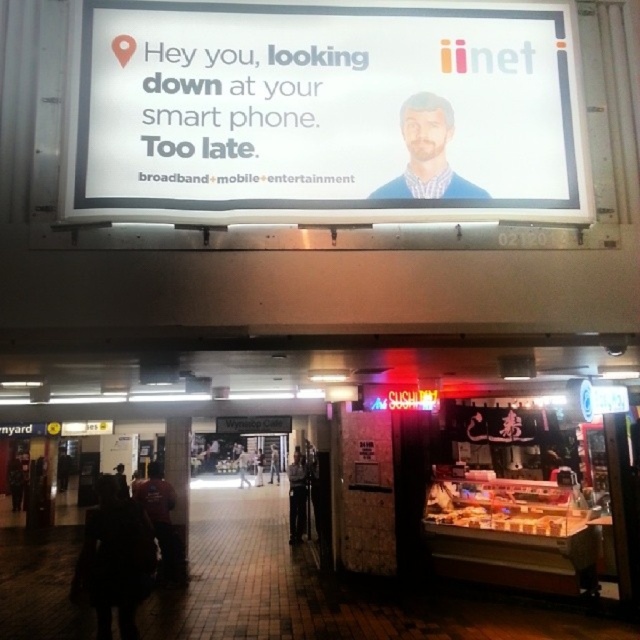
Question: Can you confirm if dark clothing at lower left is positioned below smooth skin person at center?

Choices:
 (A) no
 (B) yes

Answer: (A)

Question: Which object is farther from the camera taking this photo?

Choices:
 (A) dark clothing at lower left
 (B) matte blue shirt at center
 (C) smooth skin person at center
 (D) smooth gray shirt at center

Answer: (D)

Question: Which object is farther from the camera taking this photo?

Choices:
 (A) smooth skin person at center
 (B) smooth gray shirt at center

Answer: (B)

Question: Does smooth skin person at center have a greater width compared to smooth gray shirt at center?

Choices:
 (A) yes
 (B) no

Answer: (A)

Question: Which point is farther to the camera?

Choices:
 (A) (166, 544)
 (B) (161, 10)
 (C) (417, 129)

Answer: (A)

Question: Does matte blue shirt at center have a lesser width compared to dark red shirt at lower left?

Choices:
 (A) yes
 (B) no

Answer: (A)